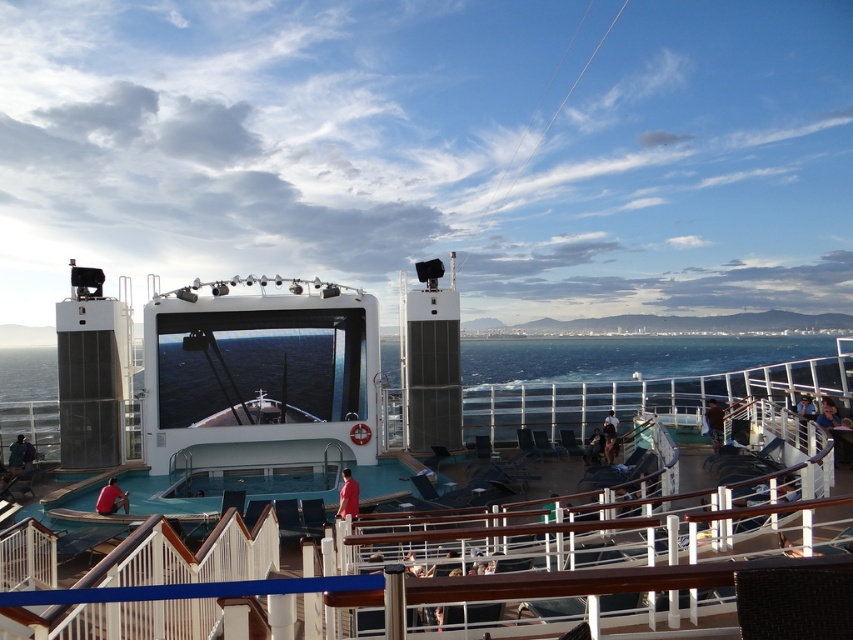
Between matte red shirt at lower left and red matte shirt at lower center, which one has less height?

With less height is matte red shirt at lower left.

Does point (115, 483) come closer to viewer compared to point (339, 496)?

Yes.

The height and width of the screenshot is (640, 853). Find the location of `matte red shirt at lower left`. matte red shirt at lower left is located at coordinates (111, 499).

Can you confirm if white glossy stage at center is positioned to the left of red matte shirt at lower center?

Incorrect, white glossy stage at center is not on the left side of red matte shirt at lower center.

Does white glossy stage at center have a larger size compared to red matte shirt at lower center?

Yes.

From the picture: Who is more distant from viewer, [693,532] or [347,472]?

Point [347,472]

What are the coordinates of `white glossy stage at center` in the screenshot? It's located at (479, 540).

Is point (25, 467) closer to camera compared to point (712, 417)?

Yes.

Who is more distant from viewer, (28, 449) or (717, 451)?

Point (28, 449)

Where is `dark blue fabric at lower left`? The width and height of the screenshot is (853, 640). dark blue fabric at lower left is located at coordinates (20, 454).